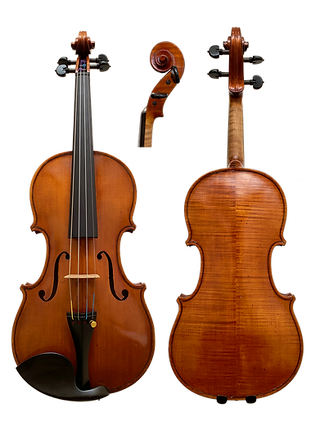
Where is `handle`? handle is located at coordinates (87, 45).